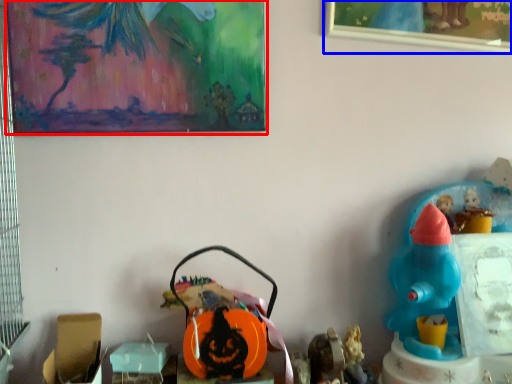
Question: Which point is closer to the camera, picture frame (highlighted by a red box) or picture frame (highlighted by a blue box)?

Choices:
 (A) picture frame
 (B) picture frame

Answer: (A)